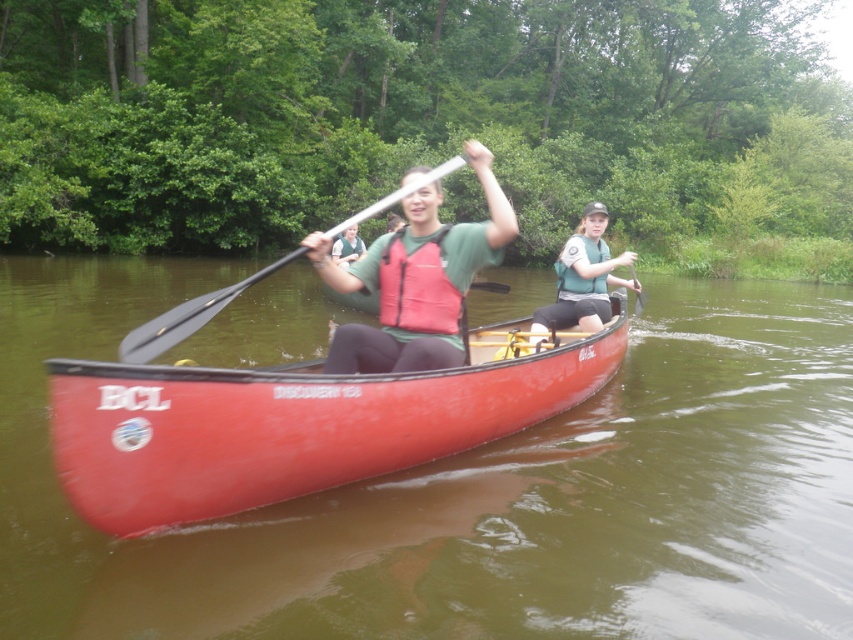
Question: Which object is closer to the camera taking this photo?

Choices:
 (A) black plastic paddle at center
 (B) matte green life vest at center

Answer: (A)

Question: Is matte green life vest at center to the right of black plastic paddle at center from the viewer's perspective?

Choices:
 (A) no
 (B) yes

Answer: (B)

Question: Does matte red canoe at center lie behind green matte life vest at center?

Choices:
 (A) no
 (B) yes

Answer: (A)

Question: Which object is the farthest from the matte green life vest at center?

Choices:
 (A) matte red canoe at center
 (B) green fabric life vest at center
 (C) black plastic paddle at center
 (D) red smooth canoe at center

Answer: (B)

Question: Can you confirm if red smooth canoe at center is positioned to the right of green fabric life vest at center?

Choices:
 (A) yes
 (B) no

Answer: (A)

Question: Based on their relative distances, which object is nearer to the matte green life vest at center?

Choices:
 (A) black plastic paddle at center
 (B) green matte life vest at center

Answer: (A)